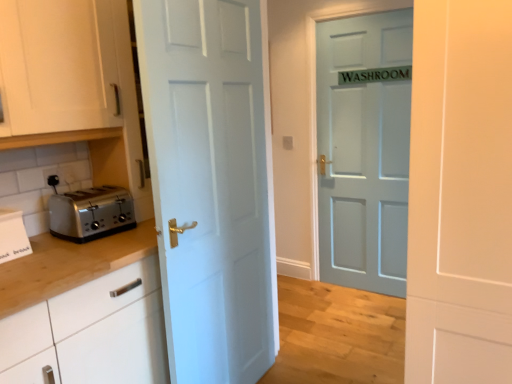
Question: Is white matte door at center, the first door in the front-to-back sequence, surrounding satin silver toaster at left?

Choices:
 (A) no
 (B) yes

Answer: (A)

Question: Is the depth of white matte door at center, the 3th door in the back-to-front sequence, less than that of satin silver toaster at left?

Choices:
 (A) yes
 (B) no

Answer: (A)

Question: Can you confirm if white matte door at center, the first door in the front-to-back sequence, is thinner than satin silver toaster at left?

Choices:
 (A) yes
 (B) no

Answer: (B)

Question: Is white matte door at center, the 3th door in the back-to-front sequence, shorter than satin silver toaster at left?

Choices:
 (A) no
 (B) yes

Answer: (A)

Question: From a real-world perspective, is white matte door at center, the first door in the front-to-back sequence, on satin silver toaster at left?

Choices:
 (A) yes
 (B) no

Answer: (B)

Question: Visually, is white cardboard box at left positioned to the left or to the right of white glossy door at center, marked as the second door in a back-to-front arrangement?

Choices:
 (A) right
 (B) left

Answer: (B)

Question: From the image's perspective, relative to white glossy door at center, marked as the second door in a back-to-front arrangement, is white cardboard box at left above or below?

Choices:
 (A) above
 (B) below

Answer: (B)

Question: In the image, is white cardboard box at left positioned in front of or behind white glossy door at center, marked as the second door in a back-to-front arrangement?

Choices:
 (A) behind
 (B) front

Answer: (A)

Question: Is point (1, 254) positioned closer to the camera than point (219, 87)?

Choices:
 (A) farther
 (B) closer

Answer: (B)

Question: Would you say white glossy door at center, marked as the second door in a back-to-front arrangement, is to the left or to the right of white matte door at center, the 3th door in the back-to-front sequence, in the picture?

Choices:
 (A) left
 (B) right

Answer: (A)

Question: Is white glossy door at center, marked as the second door in a back-to-front arrangement, bigger or smaller than white matte door at center, the 3th door in the back-to-front sequence?

Choices:
 (A) big
 (B) small

Answer: (B)

Question: From a real-world perspective, relative to white matte door at center, the 3th door in the back-to-front sequence, is white glossy door at center, marked as the second door in a back-to-front arrangement, vertically above or below?

Choices:
 (A) above
 (B) below

Answer: (B)

Question: Relative to white matte door at center, the 3th door in the back-to-front sequence, is white glossy door at center, marked as the second door in a back-to-front arrangement, in front or behind?

Choices:
 (A) front
 (B) behind

Answer: (B)

Question: From the image's perspective, relative to satin silver toaster at left, is white matte door at center, the 3th door in the back-to-front sequence, above or below?

Choices:
 (A) below
 (B) above

Answer: (A)

Question: Considering the positions of white matte door at center, the 3th door in the back-to-front sequence, and satin silver toaster at left in the image, is white matte door at center, the 3th door in the back-to-front sequence, wider or thinner than satin silver toaster at left?

Choices:
 (A) thin
 (B) wide

Answer: (B)